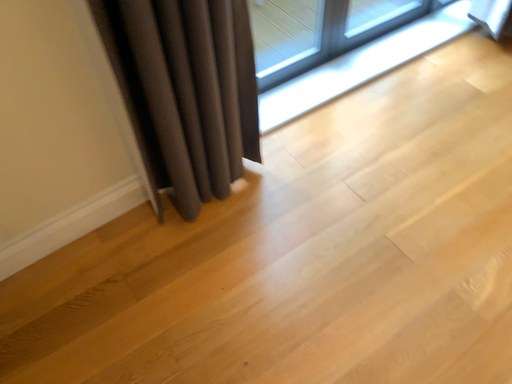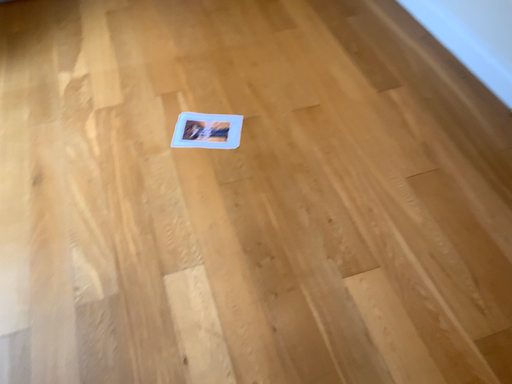
Question: How did the camera likely rotate when shooting the video?

Choices:
 (A) rotated downward
 (B) rotated upward

Answer: (B)